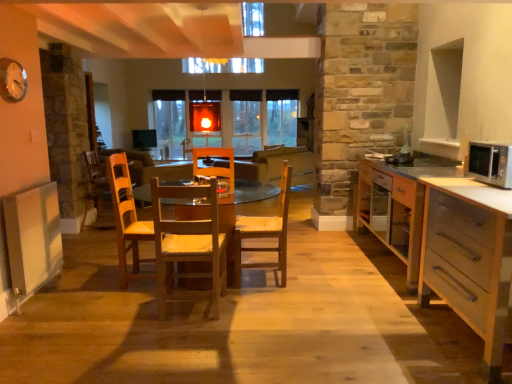
Identify the location of free space in front of wooden table at center. The image size is (512, 384). (227, 343).